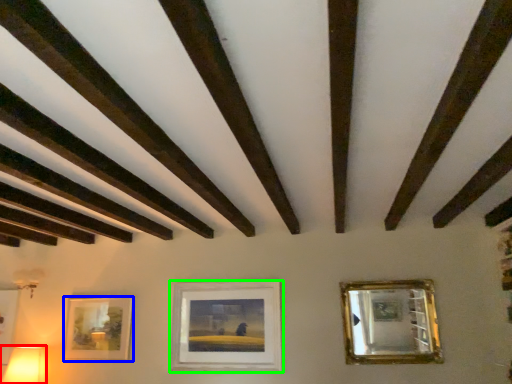
Question: Which object is positioned farthest from table lamp (highlighted by a red box)? Select from picture frame (highlighted by a blue box) and picture frame (highlighted by a green box).

Choices:
 (A) picture frame
 (B) picture frame

Answer: (B)